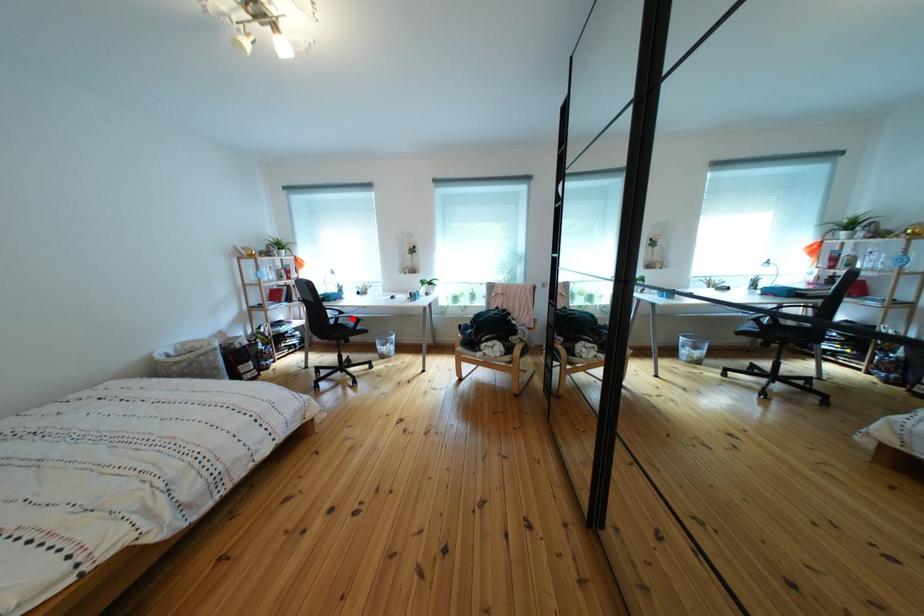
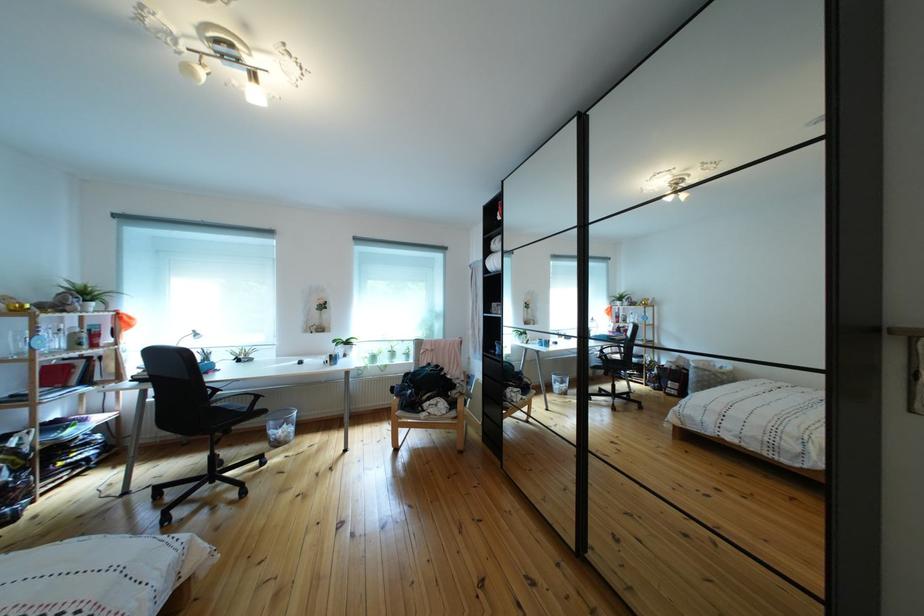
Where in the second image is the point corresponding to the highlighted location from the first image?

(227, 395)